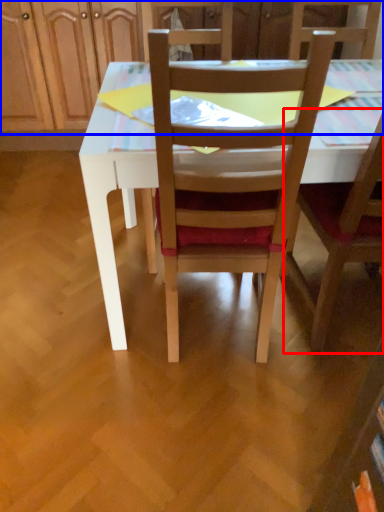
Question: Among these objects, which one is nearest to the camera, chair (highlighted by a red box) or dresser (highlighted by a blue box)?

Choices:
 (A) chair
 (B) dresser

Answer: (A)